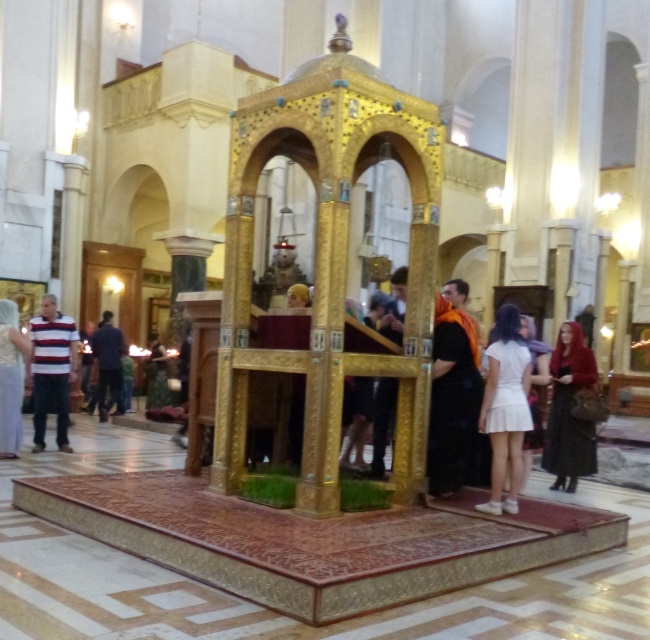
Measure the distance between velvet red coat at right and dark blue fabric at left.

velvet red coat at right is 9.47 meters away from dark blue fabric at left.

Looking at this image, measure the distance between velvet red coat at right and camera.

velvet red coat at right and camera are 8.39 meters apart from each other.

What are the coordinates of `velvet red coat at right` in the screenshot? It's located at (569, 410).

Can you confirm if white matte skirt at center is thinner than dark blue fabric at left?

Yes.

What do you see at coordinates (504, 406) in the screenshot? I see `white matte skirt at center` at bounding box center [504, 406].

Who is more distant from viewer, (510, 444) or (98, 376)?

Positioned behind is point (98, 376).

Identify the location of white matte skirt at center. This screenshot has height=640, width=650. (504, 406).

Is velvet red coat at right thinner than dark brown leather jacket at center?

Yes.

Can you confirm if velvet red coat at right is positioned below dark brown leather jacket at center?

No.

Is point (592, 358) farther from viewer compared to point (150, 368)?

No.

This screenshot has width=650, height=640. In order to click on velvet red coat at right in this screenshot , I will do `click(569, 410)`.